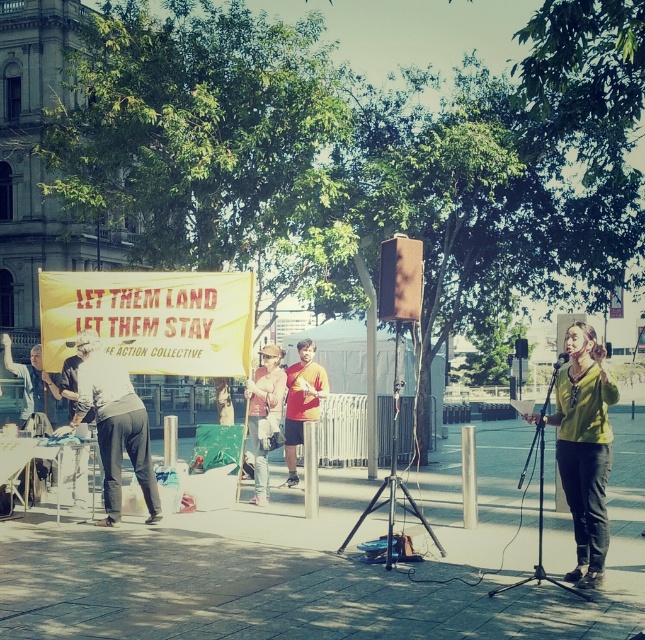
Question: Can you confirm if green matte shirt at center is positioned above orange cotton shirt at center?

Choices:
 (A) no
 (B) yes

Answer: (B)

Question: Among these points, which one is farthest from the camera?

Choices:
 (A) (586, 468)
 (B) (566, 353)
 (C) (253, 388)

Answer: (C)

Question: Which point is farther to the camera?

Choices:
 (A) green matte shirt at center
 (B) matte black pants at center
 (C) denim jacket at center

Answer: (C)

Question: Is green matte shirt at center below denim jacket at center?

Choices:
 (A) yes
 (B) no

Answer: (A)

Question: Which object is closer to the camera taking this photo?

Choices:
 (A) denim jacket at center
 (B) orange cotton shirt at center
 (C) matte black pants at center
 (D) green matte shirt at center

Answer: (D)

Question: Where is green matte shirt at center located in relation to black matte microphone at center in the image?

Choices:
 (A) right
 (B) left

Answer: (B)